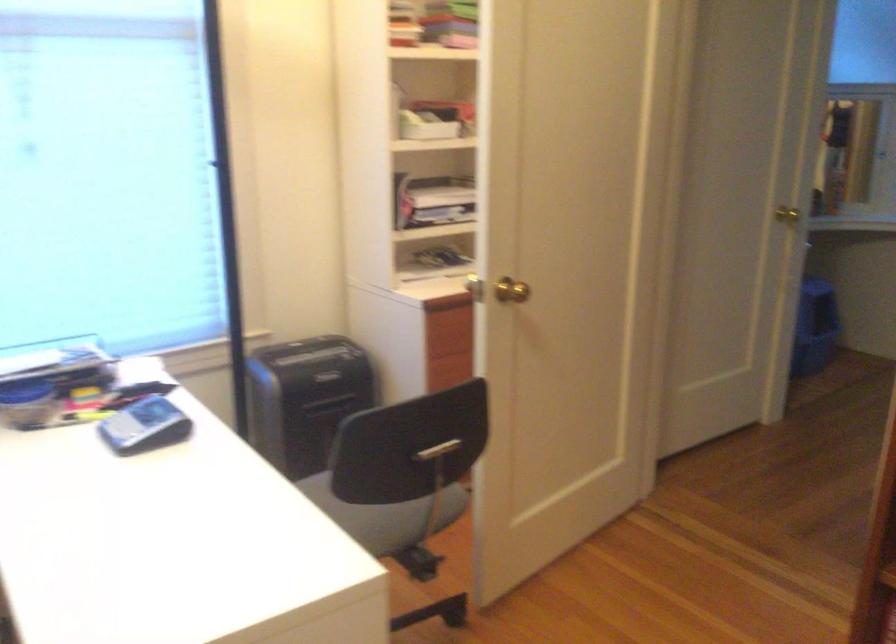
You are a GUI agent. You are given a task and a screenshot of the screen. Output one action in this format:
    pyautogui.click(x=<x>, y=<y>)
    Task: Click on the chair sitting surface
    The height and width of the screenshot is (644, 896).
    Given the screenshot: What is the action you would take?
    pyautogui.click(x=383, y=515)